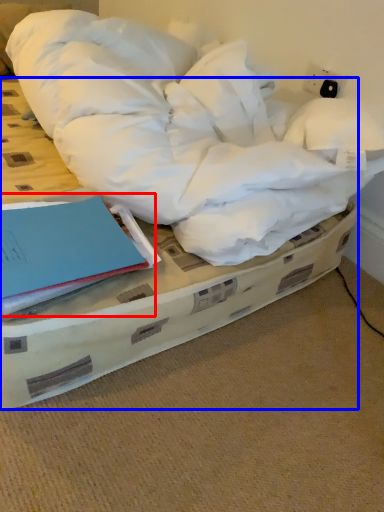
Question: Which object is further to the camera taking this photo, paperback book (highlighted by a red box) or bed (highlighted by a blue box)?

Choices:
 (A) paperback book
 (B) bed

Answer: (A)